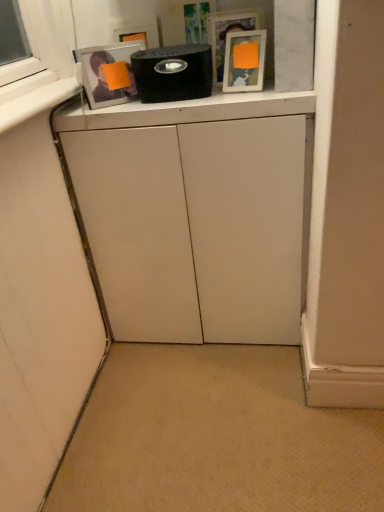
Where is `free location in front of black matte speaker at upper center`? Image resolution: width=384 pixels, height=512 pixels. free location in front of black matte speaker at upper center is located at coordinates (180, 105).